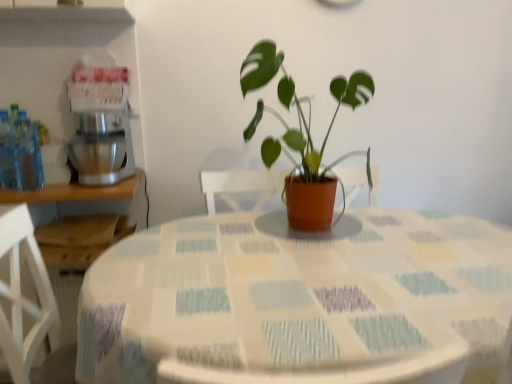
Identify the location of vacant point to the right of matte terracotta pot at center. (413, 230).